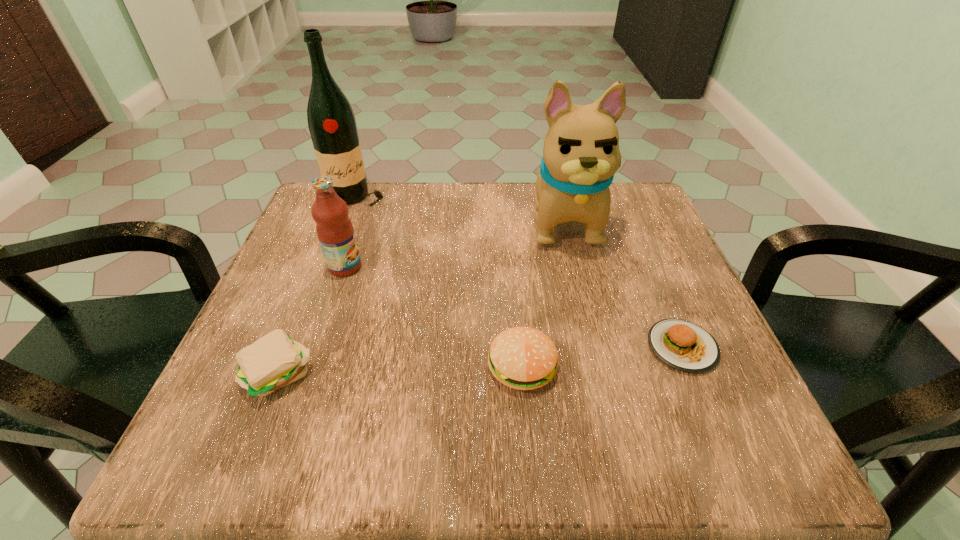
This screenshot has height=540, width=960. I want to click on empty space that is in between the leftmost food and the wine bottle, so click(x=317, y=287).

Where is `unoccupied area between the third tallest object and the puppy`? unoccupied area between the third tallest object and the puppy is located at coordinates (455, 244).

Identify the location of unoccupied position between the second food from left to right and the fruit juice. This screenshot has width=960, height=540. (434, 316).

This screenshot has height=540, width=960. Find the location of `unoccupied position between the leftmost food and the fourth shortest object`. unoccupied position between the leftmost food and the fourth shortest object is located at coordinates (311, 321).

The width and height of the screenshot is (960, 540). What are the coordinates of `free spot between the third tallest object and the rightmost object` in the screenshot? It's located at (514, 307).

Locate an element on the screen. free area in between the rightmost object and the second food from right to left is located at coordinates (602, 357).

What are the coordinates of `free space that is in between the puppy and the rightmost food` in the screenshot? It's located at (623, 284).

The width and height of the screenshot is (960, 540). I want to click on free space between the wine bottle and the shortest object, so click(519, 273).

This screenshot has height=540, width=960. I want to click on vacant region between the shortest object and the wine bottle, so click(x=519, y=273).

Identify the location of object that stands as the third closest to the fruit juice. (523, 358).